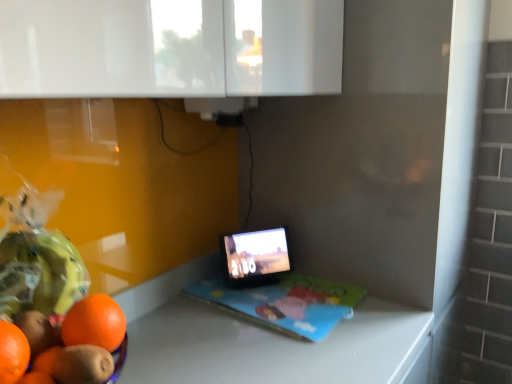
Where is `matte black laptop at center`? matte black laptop at center is located at coordinates click(275, 287).

This screenshot has width=512, height=384. Describe the element at coordinates (275, 287) in the screenshot. I see `matte black laptop at center` at that location.

What do you see at coordinates (254, 257) in the screenshot? This screenshot has width=512, height=384. I see `black glossy tablet at center` at bounding box center [254, 257].

Identify the location of black glossy tablet at center. (254, 257).

In order to face black glossy tablet at center, should I rotate leftwards or rightwards?

It's best to rotate right around 0.428 degrees.

Locate an element on the screen. The image size is (512, 384). matte black laptop at center is located at coordinates (275, 287).

Is black glossy tablet at center to the left or to the right of matte black laptop at center in the image?

black glossy tablet at center is to the left of matte black laptop at center.

Which is in front, black glossy tablet at center or matte black laptop at center?

matte black laptop at center is more forward.

Is point (252, 273) positioned in front of point (311, 285)?

No.

From the picture: From the image's perspective, does black glossy tablet at center appear higher than matte black laptop at center?

Correct, black glossy tablet at center appears higher than matte black laptop at center in the image.

From a real-world perspective, is black glossy tablet at center under matte black laptop at center?

No, from a real-world perspective, black glossy tablet at center is not below matte black laptop at center.

Which object is wider, black glossy tablet at center or matte black laptop at center?

matte black laptop at center.

Considering the sizes of objects black glossy tablet at center and matte black laptop at center in the image provided, who is taller, black glossy tablet at center or matte black laptop at center?

black glossy tablet at center.

Can you confirm if black glossy tablet at center is smaller than matte black laptop at center?

Actually, black glossy tablet at center might be larger than matte black laptop at center.

Is black glossy tablet at center completely or partially outside of matte black laptop at center?

Yes, black glossy tablet at center is located beyond the bounds of matte black laptop at center.

Would you consider black glossy tablet at center to be distant from matte black laptop at center?

That's not correct — black glossy tablet at center is a little close to matte black laptop at center.

Looking at this image, is black glossy tablet at center looking in the opposite direction of matte black laptop at center?

No.

Can you tell me how much black glossy tablet at center and matte black laptop at center differ in facing direction?

The facing directions of black glossy tablet at center and matte black laptop at center are 34.4 degrees apart.

The image size is (512, 384). In the image, there is a black glossy tablet at center. What are the coordinates of `laptop below it (from a real-world perspective)` in the screenshot? It's located at [x=275, y=287].

Considering the relative positions of matte black laptop at center and black glossy tablet at center in the image provided, is matte black laptop at center to the left of black glossy tablet at center from the viewer's perspective?

Incorrect, matte black laptop at center is not on the left side of black glossy tablet at center.

Is matte black laptop at center closer to camera compared to black glossy tablet at center?

Yes, it is.

Between point (232, 283) and point (278, 251), which one is positioned behind?

The point (278, 251) is more distant.

In the scene shown: From the image's perspective, which one is positioned higher, matte black laptop at center or black glossy tablet at center?

black glossy tablet at center is shown above in the image.

From the picture: From a real-world perspective, which object stands above the other?

black glossy tablet at center, from a real-world perspective.

Can you confirm if matte black laptop at center is thinner than black glossy tablet at center?

No.

Is matte black laptop at center taller than black glossy tablet at center?

Incorrect, the height of matte black laptop at center is not larger of that of black glossy tablet at center.

Is matte black laptop at center smaller than black glossy tablet at center?

Correct, matte black laptop at center occupies less space than black glossy tablet at center.

Can black glossy tablet at center be found inside matte black laptop at center?

Definitely not — black glossy tablet at center is not inside matte black laptop at center.

Are matte black laptop at center and black glossy tablet at center far apart?

No.

Is matte black laptop at center facing towards black glossy tablet at center?

No, matte black laptop at center does not turn towards black glossy tablet at center.

How many degrees apart are the facing directions of matte black laptop at center and black glossy tablet at center?

The angular difference between matte black laptop at center and black glossy tablet at center is 34.4 degrees.

How distant is matte black laptop at center from black glossy tablet at center?

A distance of 2.86 inches exists between matte black laptop at center and black glossy tablet at center.

Locate an element on the screen. The image size is (512, 384). tablet computer on the left of matte black laptop at center is located at coordinates (254, 257).

What are the coordinates of `laptop located on the right of black glossy tablet at center` in the screenshot? It's located at click(x=275, y=287).

Identify the location of tablet computer that is above the matte black laptop at center (from the image's perspective). (254, 257).